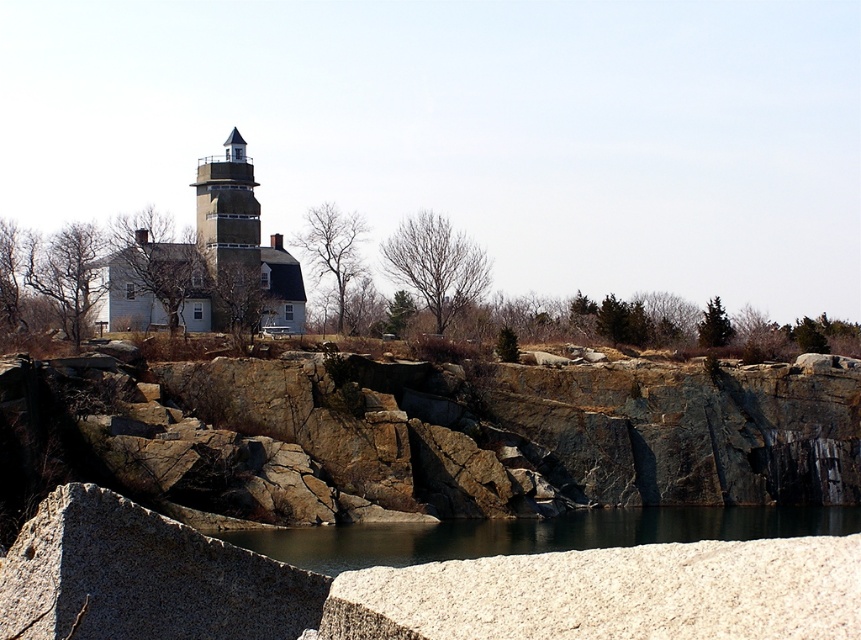
Which is more to the left, brown rock cliff at center or dark gray water at center?

Positioned to the left is brown rock cliff at center.

Based on the photo, can you confirm if brown rock cliff at center is wider than dark gray water at center?

Correct, the width of brown rock cliff at center exceeds that of dark gray water at center.

Locate an element on the screen. brown rock cliff at center is located at coordinates (438, 435).

Is brown rock cliff at center to the left of matte gray stone tower at center from the viewer's perspective?

No, brown rock cliff at center is not to the left of matte gray stone tower at center.

Does brown rock cliff at center lie behind matte gray stone tower at center?

That is False.

Locate an element on the screen. This screenshot has height=640, width=861. brown rock cliff at center is located at coordinates (438, 435).

Does point (717, 536) come farther from viewer compared to point (234, 218)?

No, it is in front of (234, 218).

The image size is (861, 640). Find the location of `dark gray water at center`. dark gray water at center is located at coordinates (537, 532).